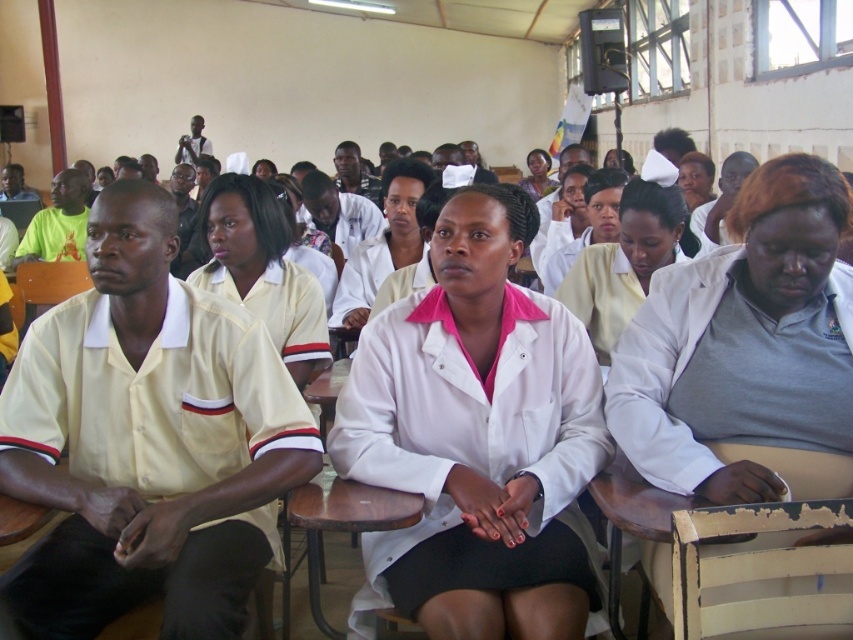
Question: Which point appears farthest from the camera in this image?

Choices:
 (A) (352, 616)
 (B) (843, 412)

Answer: (A)

Question: Which object is closer to the camera taking this photo?

Choices:
 (A) white smooth shirt at center
 (B) white lab coat at center
 (C) white smooth lab coat at center

Answer: (B)

Question: Is white smooth nurse cap at center smaller than matte white coat at center?

Choices:
 (A) yes
 (B) no

Answer: (A)

Question: Estimate the real-world distances between objects in this image. Which object is farther from the white smooth lab coat at center?

Choices:
 (A) chipped paint wood chair at lower right
 (B) wooden chair at left

Answer: (B)

Question: Is wooden chair at left to the left of matte white coat at center from the viewer's perspective?

Choices:
 (A) yes
 (B) no

Answer: (A)

Question: Where is white smooth shirt at center located in relation to white smooth nurse cap at center in the image?

Choices:
 (A) right
 (B) left

Answer: (B)